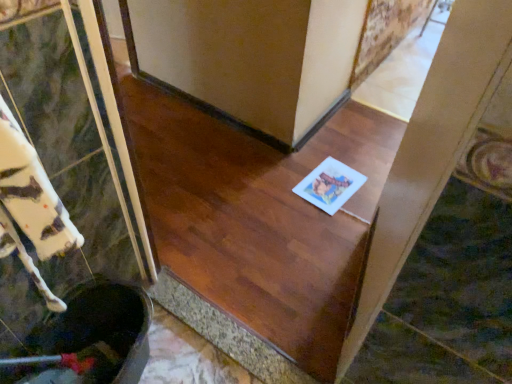
Where is `free space to the back side of white paper at center`? This screenshot has height=384, width=512. free space to the back side of white paper at center is located at coordinates (330, 150).